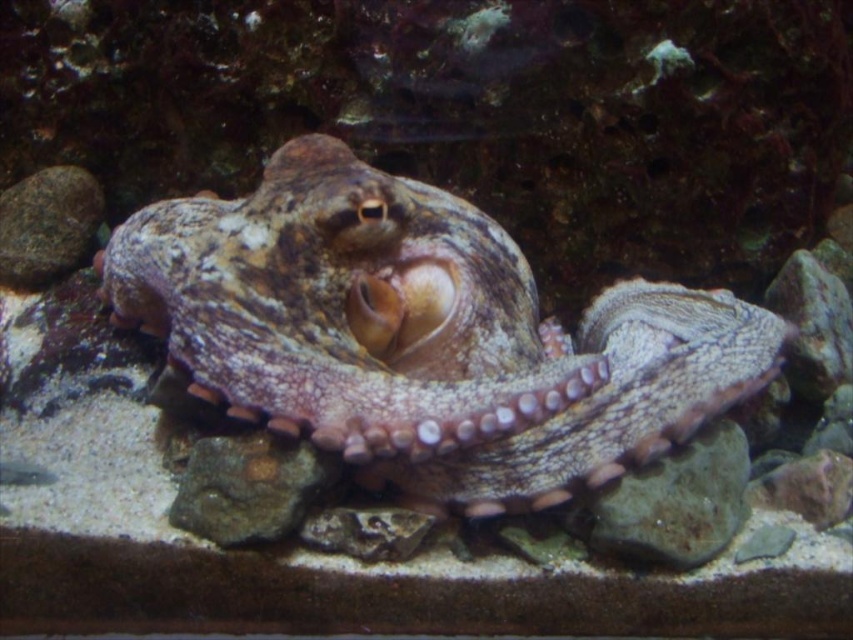
Is green mossy rock at center below gray rock at upper left?

Yes.

From the picture: Measure the distance between green mossy rock at center and camera.

green mossy rock at center is 4.62 feet away from camera.

The height and width of the screenshot is (640, 853). In order to click on green mossy rock at center in this screenshot , I will do `click(251, 486)`.

Between smooth gray rock at lower right and gray rock at upper left, which one has less height?

smooth gray rock at lower right is shorter.

Between point (648, 520) and point (26, 211), which one is positioned in front?

Point (648, 520) is in front.

Find the location of `smooth gray rock at lower right`. smooth gray rock at lower right is located at coordinates (676, 502).

The width and height of the screenshot is (853, 640). In order to click on smooth gray rock at lower right in this screenshot , I will do `click(676, 502)`.

From the picture: Measure the distance between camouflage skin octopus at center and green mossy rock at center.

camouflage skin octopus at center is 10.10 inches from green mossy rock at center.

This screenshot has height=640, width=853. What are the coordinates of `camouflage skin octopus at center` in the screenshot? It's located at (422, 333).

Image resolution: width=853 pixels, height=640 pixels. I want to click on camouflage skin octopus at center, so [422, 333].